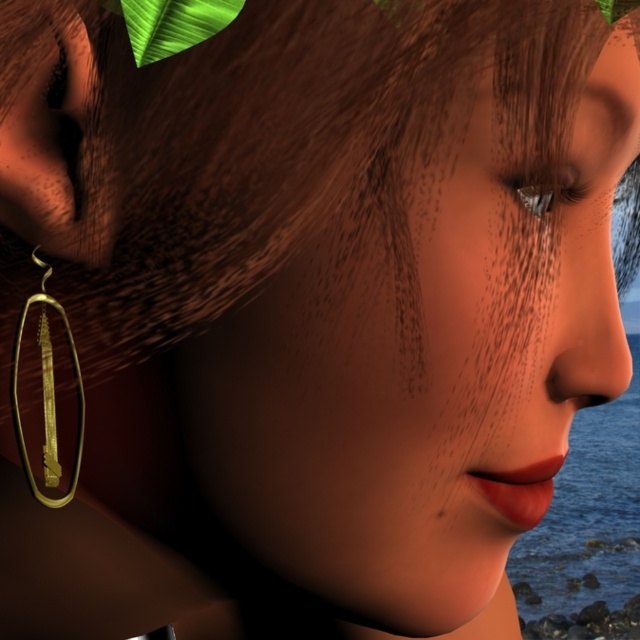
Does point (516, 582) come closer to viewer compared to point (16, 433)?

No, it is behind (16, 433).

Is point (637, 563) more distant than point (70, 355)?

Yes, it is.

Find the location of `blue water at right`. blue water at right is located at coordinates (588, 531).